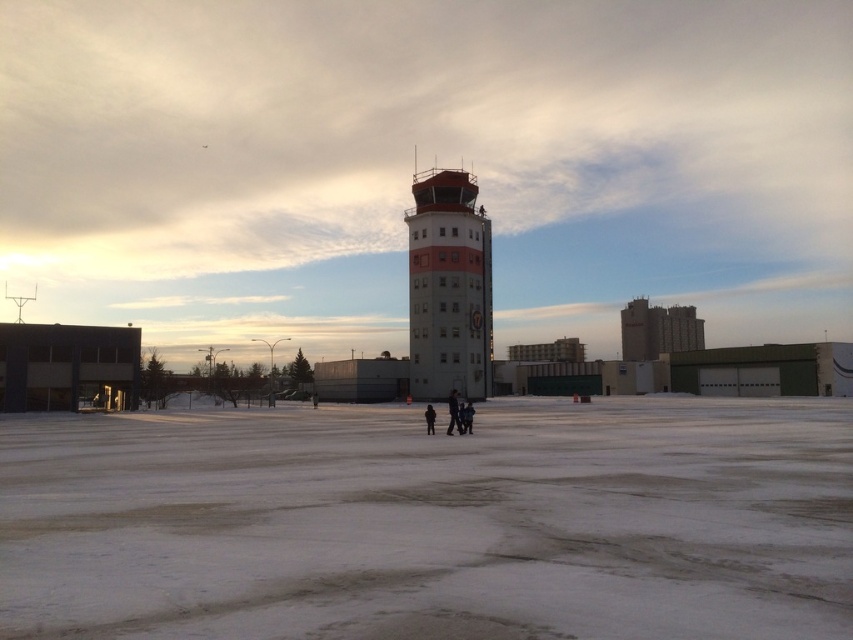
Does white powdery snow at center have a lesser height compared to white concrete control tower at center?

Indeed, white powdery snow at center has a lesser height compared to white concrete control tower at center.

Does white powdery snow at center have a greater width compared to white concrete control tower at center?

Correct, the width of white powdery snow at center exceeds that of white concrete control tower at center.

Find the location of a particular element. This screenshot has height=640, width=853. white powdery snow at center is located at coordinates (432, 522).